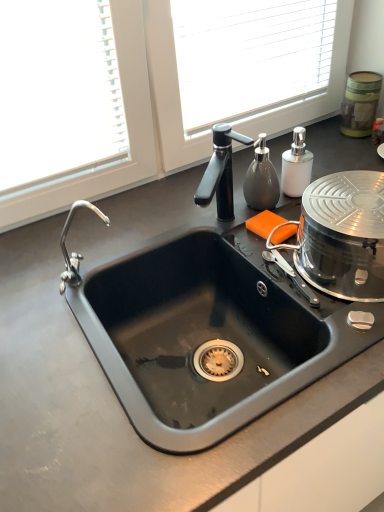
At what (x,y) coordinates should I click in order to perform the action: click on free space in front of green textured canister at upper right, the second appliance positioned from the front. Please return your answer as a coordinate pair (x, y). This screenshot has height=512, width=384. Looking at the image, I should click on (350, 157).